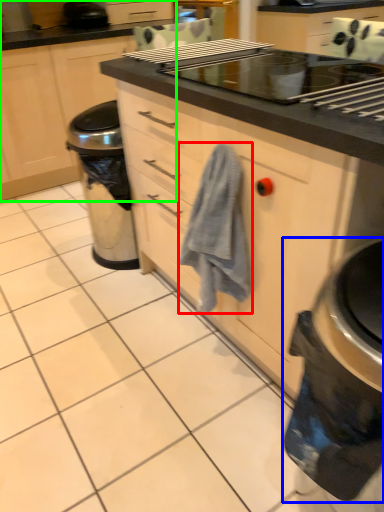
Question: Considering the real-world distances, which object is closest to bath towel (highlighted by a red box)? home appliance (highlighted by a blue box) or cabinetry (highlighted by a green box).

Choices:
 (A) home appliance
 (B) cabinetry

Answer: (A)